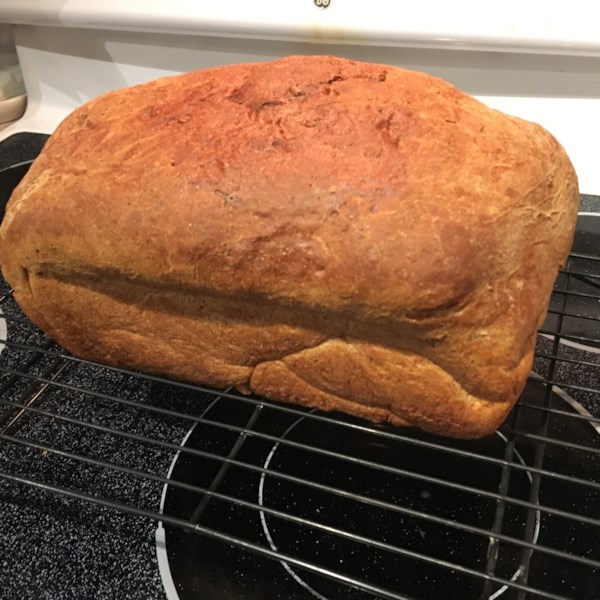
Where is `stove burner`? stove burner is located at coordinates (220, 571).